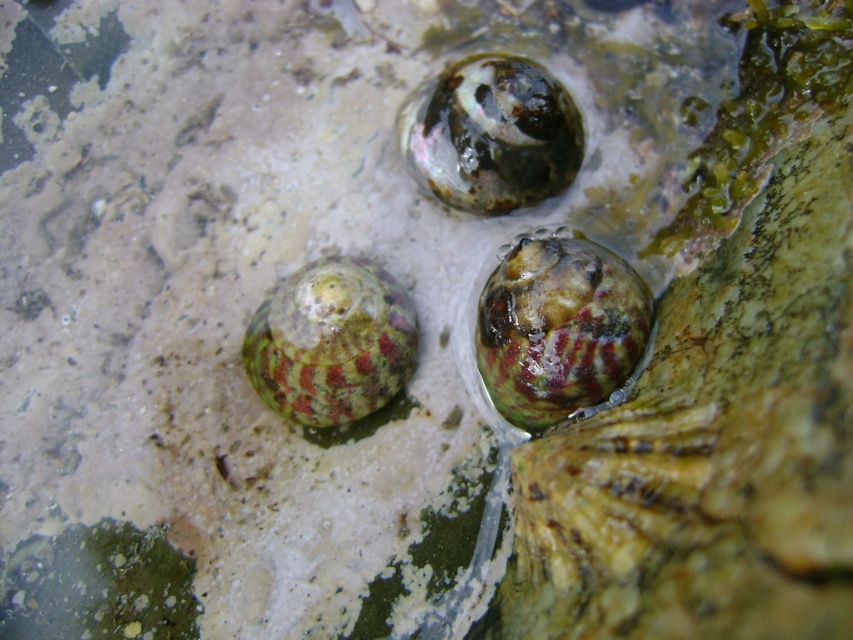
Question: Is green mottled shell at center bigger than speckled stone shell at upper center?

Choices:
 (A) yes
 (B) no

Answer: (A)

Question: Is green mottled shell at center positioned at the back of speckled stone shell at upper center?

Choices:
 (A) yes
 (B) no

Answer: (B)

Question: Which object is the farthest from the speckled stone shell at upper center?

Choices:
 (A) green marbled shell at center
 (B) green mottled shell at center

Answer: (A)

Question: Among these objects, which one is nearest to the camera?

Choices:
 (A) green marbled shell at center
 (B) green mottled shell at center

Answer: (B)

Question: Estimate the real-world distances between objects in this image. Which object is farther from the speckled stone shell at upper center?

Choices:
 (A) green marbled shell at center
 (B) green mottled shell at center

Answer: (A)

Question: Is green mottled shell at center closer to camera compared to green marbled shell at center?

Choices:
 (A) no
 (B) yes

Answer: (B)